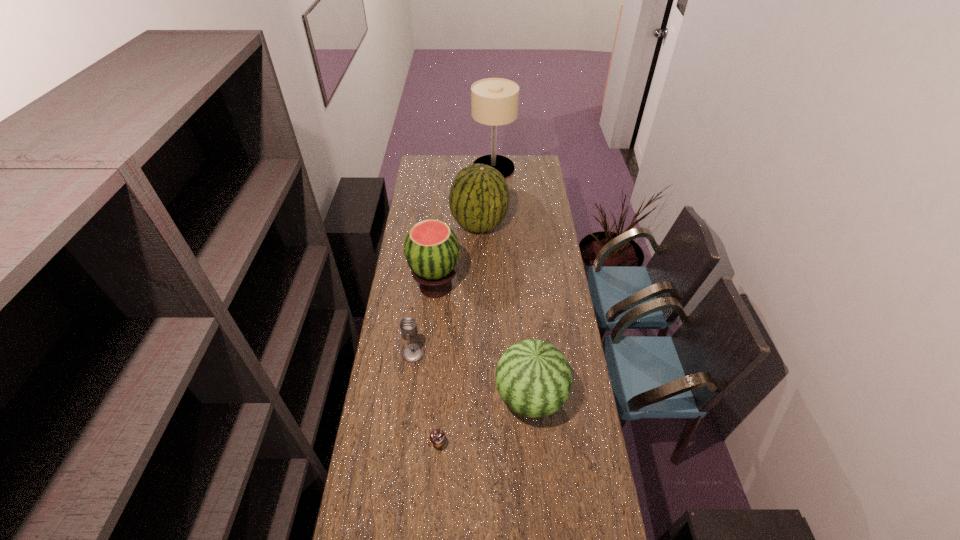
Locate an element on the screen. watermelon object that ranks as the closest to the table lamp is located at coordinates (x=479, y=197).

Locate an element on the screen. This screenshot has height=540, width=960. the second closest watermelon relative to the second nearest object is located at coordinates (479, 197).

Locate an element on the screen. vacant region that satisfies the following two spatial constraints: 1. on the back side of the third farthest object; 2. on the right side of the table lamp is located at coordinates (447, 168).

Locate an element on the screen. vacant space that satisfies the following two spatial constraints: 1. on the back side of the nearest object; 2. on the left side of the farthest watermelon is located at coordinates (453, 225).

The height and width of the screenshot is (540, 960). Identify the location of vacant area that satisfies the following two spatial constraints: 1. on the back side of the fourth farthest object; 2. on the right side of the table lamp. (437, 168).

Identify the location of vacant space that satisfies the following two spatial constraints: 1. on the back side of the second farthest watermelon; 2. on the right side of the tallest object. Image resolution: width=960 pixels, height=540 pixels. (447, 168).